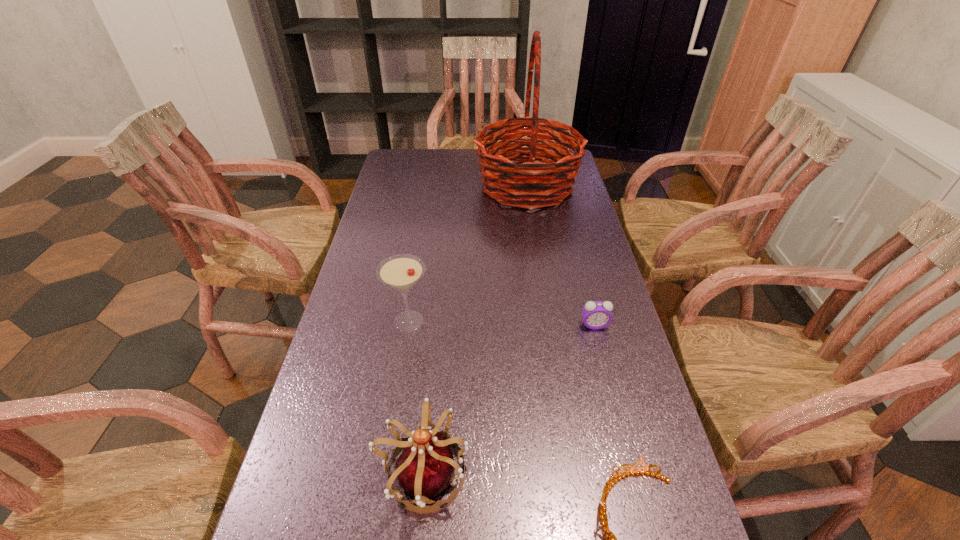
The height and width of the screenshot is (540, 960). Identify the location of the farthest object. 546,183.

The image size is (960, 540). In order to click on basket in this screenshot , I will do `click(546, 183)`.

At what (x,y) coordinates should I click in order to perform the action: click on martini. Please return your answer as a coordinate pair (x, y). Image resolution: width=960 pixels, height=540 pixels. Looking at the image, I should click on (402, 271).

Where is `the left tiara`? the left tiara is located at coordinates (426, 467).

Where is `alarm clock`? alarm clock is located at coordinates (596, 315).

The height and width of the screenshot is (540, 960). I want to click on blank area located 0.110m on the front of the tallest object, so click(x=535, y=235).

Where is `free region located 0.140m on the front of the martini`? This screenshot has height=540, width=960. free region located 0.140m on the front of the martini is located at coordinates (398, 387).

I want to click on vacant area located on the front-facing side of the left tiara, so 564,474.

Where is `free location located on the face of the alarm clock`? Image resolution: width=960 pixels, height=540 pixels. free location located on the face of the alarm clock is located at coordinates (630, 462).

I want to click on object that is at the far edge, so click(x=546, y=183).